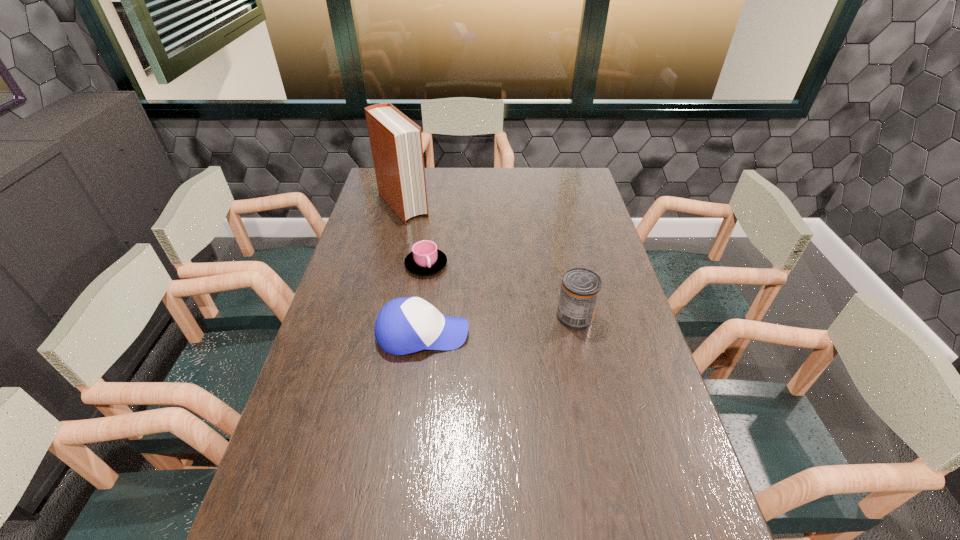
Locate an element on the screen. free location located on the open cover of the farthest object is located at coordinates (422, 231).

Image resolution: width=960 pixels, height=540 pixels. I want to click on free location located on the open cover of the farthest object, so click(x=425, y=234).

The height and width of the screenshot is (540, 960). Find the location of `free space located on the side with the handle of the shortest object`. free space located on the side with the handle of the shortest object is located at coordinates (456, 298).

This screenshot has height=540, width=960. Find the location of `vacant point located 0.340m on the side with the handle of the shortest object`. vacant point located 0.340m on the side with the handle of the shortest object is located at coordinates (497, 342).

This screenshot has height=540, width=960. Find the location of `vacant region located on the side with the handle of the shortest object`. vacant region located on the side with the handle of the shortest object is located at coordinates (510, 356).

Find the location of `object located in the far edge section of the desktop`. object located in the far edge section of the desktop is located at coordinates (396, 142).

Where is `object positioned at the left edge`? object positioned at the left edge is located at coordinates (396, 142).

Locate an element on the screen. object at the right edge is located at coordinates (580, 289).

The width and height of the screenshot is (960, 540). In order to click on object present at the far left corner in this screenshot , I will do `click(396, 142)`.

In the image, there is a desktop. Identify the location of vacant region at the far edge. (546, 190).